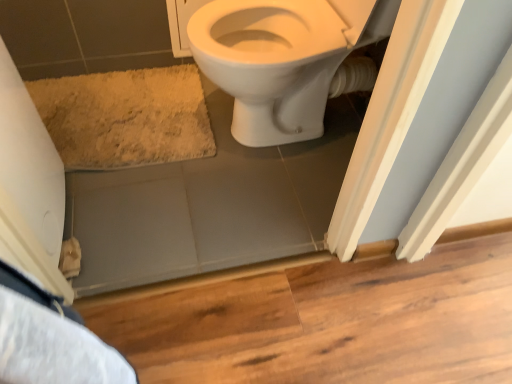
Identify the location of empty space that is ontop of beige shaggy bath mat at lower left. (106, 108).